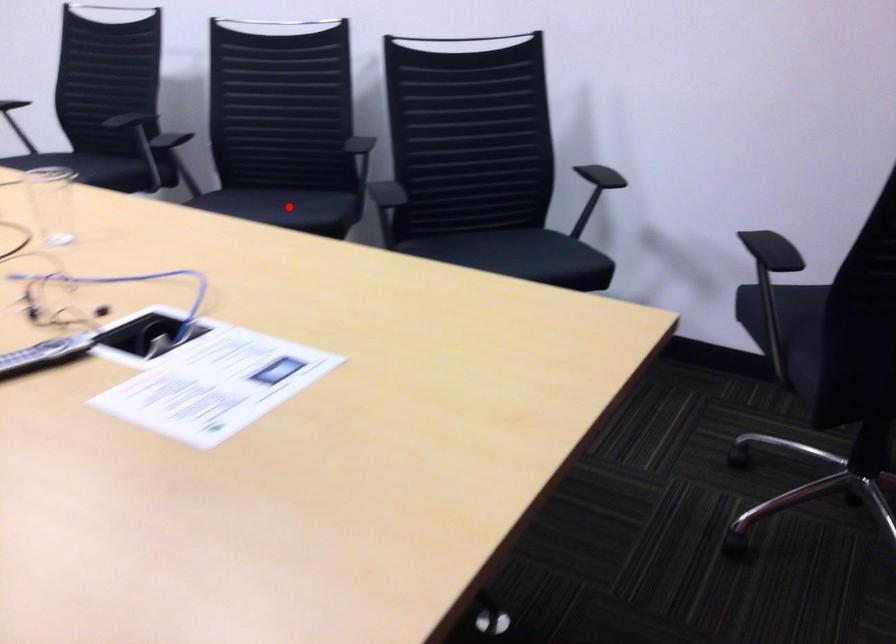
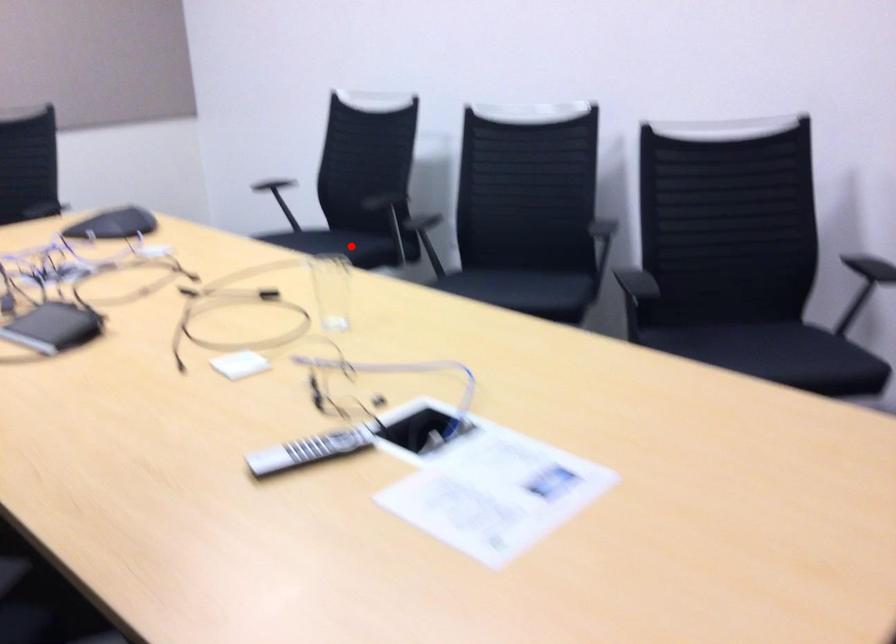
I am providing you with two images of the same scene from different viewpoints. A red point is marked on the first image and another point is marked on the second image. Do the highlighted points in image1 and image2 indicate the same real-world spot?

No